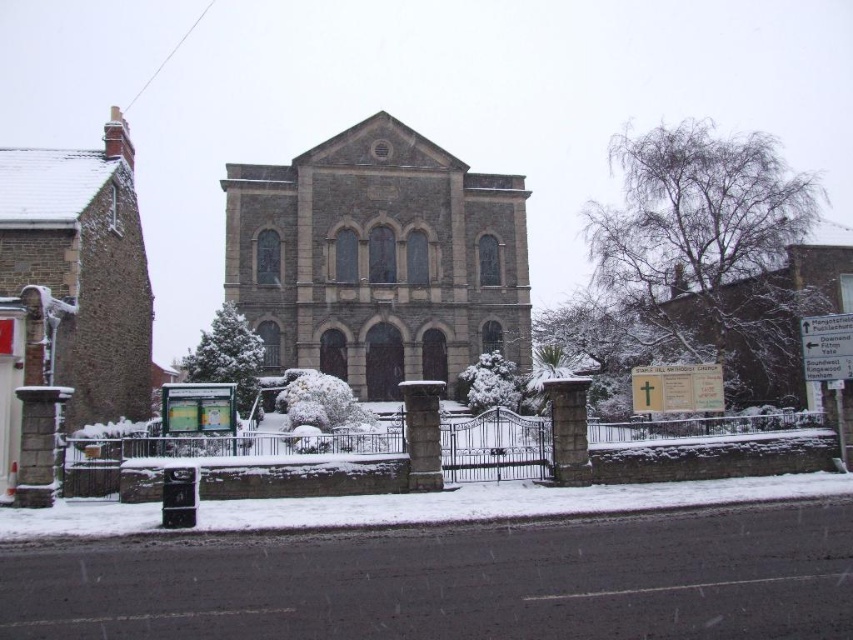
Question: Which of the following is the farthest from the observer?

Choices:
 (A) white powdery snow at lower center
 (B) brown stone church at left

Answer: (B)

Question: Which of the following is the closest to the observer?

Choices:
 (A) brown stone church at center
 (B) white powdery snow at lower center

Answer: (B)

Question: Can you confirm if brown stone church at center is positioned to the right of brown stone church at left?

Choices:
 (A) no
 (B) yes

Answer: (B)

Question: Can you confirm if brown stone church at left is thinner than white powdery snow at lower center?

Choices:
 (A) yes
 (B) no

Answer: (A)

Question: Estimate the real-world distances between objects in this image. Which object is farther from the white powdery snow at lower center?

Choices:
 (A) brown stone church at center
 (B) brown stone church at left

Answer: (A)

Question: Does brown stone church at center have a greater width compared to brown stone church at left?

Choices:
 (A) yes
 (B) no

Answer: (A)